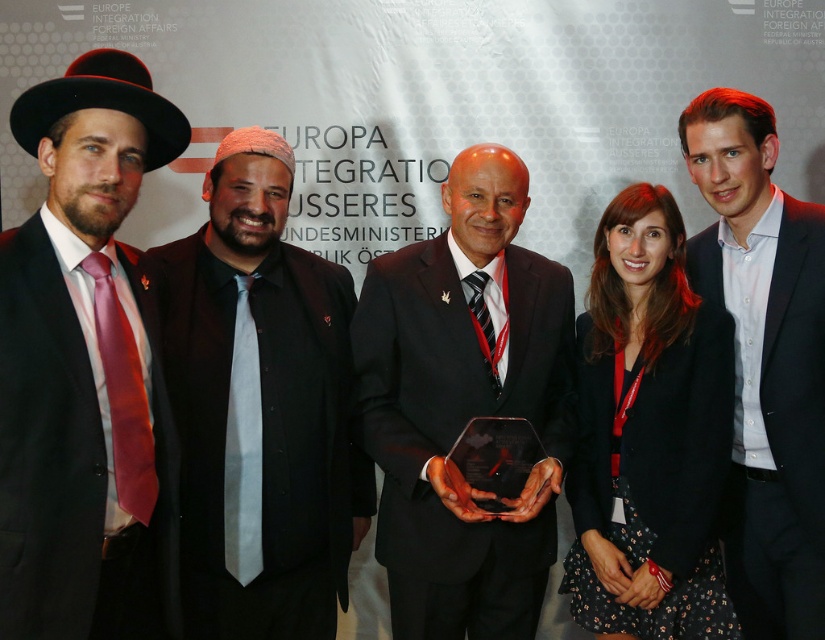
You are a photographer at the event and need to adjust the lighting to highlight both the black glossy award at center and the black textured blazer at center. Which object should you focus on first to ensure proper exposure, considering their positions?

The black glossy award at center is located above the black textured blazer at center, so you should focus on the black glossy award at center first to ensure proper exposure since it is higher up and might require different lighting adjustments.

You are attending a formal event and notice two items in the scene described. The first is a matte black suit at left, and the second is a white shirt at center. Based on their positions, which item is positioned higher up in the image?

The matte black suit at left is located above the white shirt at center, so it is positioned higher up in the image.

You are a photographer at the event and want to ensure the black glossy award at center and the black textured blazer at center are both visible in the final photo. Given their sizes, which one might require more careful framing to avoid being overshadowed?

The black textured blazer at center is shorter than the black glossy award at center, so the award might overshadow it. To ensure visibility, frame the photo so the award is slightly elevated or positioned to the side, allowing both elements to be clearly seen.